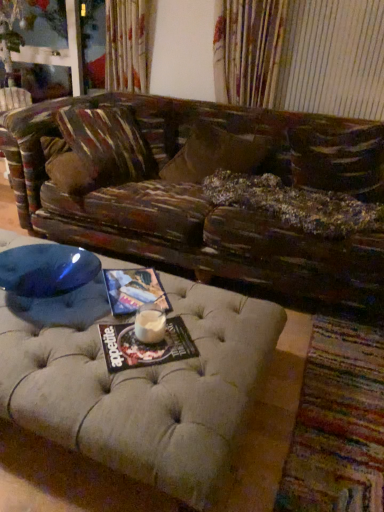
Measure the distance between point (149, 268) and camera.

Point (149, 268) is 6.05 feet from camera.

What do you see at coordinates (13, 101) in the screenshot? The width and height of the screenshot is (384, 512). I see `wooden swivel chair at left` at bounding box center [13, 101].

What are the coordinates of `white frothy liquid at center` in the screenshot? It's located at (150, 324).

Describe the element at coordinates (139, 383) in the screenshot. I see `distressed wood studio couch at center` at that location.

What do you see at coordinates (217, 153) in the screenshot?
I see `fuzzy brown pillow at center` at bounding box center [217, 153].

The height and width of the screenshot is (512, 384). What are the coordinates of `multicolored woven mat at lower right` in the screenshot? It's located at (338, 424).

Is white frothy liquid at center facing towards matte paper magazine at center, acting as the 2th magazine starting from the front?

No, white frothy liquid at center is not turned towards matte paper magazine at center, acting as the 2th magazine starting from the front.

In the scene shown: Are white frothy liquid at center and matte paper magazine at center, acting as the 2th magazine starting from the front, beside each other?

white frothy liquid at center is not next to matte paper magazine at center, acting as the 2th magazine starting from the front, and they're not touching.

Do you think white frothy liquid at center is within matte paper magazine at center, the 1th magazine viewed from the back, or outside of it?

white frothy liquid at center is not enclosed by matte paper magazine at center, the 1th magazine viewed from the back.

Is white frothy liquid at center shorter than matte paper magazine at center, the 1th magazine viewed from the back?

No, white frothy liquid at center is not shorter than matte paper magazine at center, the 1th magazine viewed from the back.

Where is `pillow on the right of wooden swivel chair at left`? Image resolution: width=384 pixels, height=512 pixels. pillow on the right of wooden swivel chair at left is located at coordinates (217, 153).

Is wooden swivel chair at left positioned before fuzzy brown pillow at center?

No, the depth of wooden swivel chair at left is greater than that of fuzzy brown pillow at center.

Which is more to the right, wooden swivel chair at left or fuzzy brown pillow at center?

fuzzy brown pillow at center is more to the right.

Consider the image. Considering the sizes of distressed wood studio couch at center and wooden swivel chair at left in the image, is distressed wood studio couch at center wider or thinner than wooden swivel chair at left?

distressed wood studio couch at center is wider than wooden swivel chair at left.

Considering the relative positions of distressed wood studio couch at center and wooden swivel chair at left in the image provided, is distressed wood studio couch at center behind wooden swivel chair at left?

That is False.

Does distressed wood studio couch at center contain wooden swivel chair at left?

No, distressed wood studio couch at center does not contain wooden swivel chair at left.

Considering the sizes of distressed wood studio couch at center and wooden swivel chair at left in the image, is distressed wood studio couch at center taller or shorter than wooden swivel chair at left?

distressed wood studio couch at center is shorter than wooden swivel chair at left.

Is matte paper magazine at center, the second magazine viewed from the top, a part of fuzzy brown pillow at center?

Definitely not — matte paper magazine at center, the second magazine viewed from the top, is not inside fuzzy brown pillow at center.

Between fuzzy brown pillow at center and matte paper magazine at center, marked as the 1th magazine in a bottom-to-top arrangement, which one has less height?

matte paper magazine at center, marked as the 1th magazine in a bottom-to-top arrangement, is shorter.

Which object is further away from the camera taking this photo, fuzzy brown pillow at center or matte paper magazine at center, the second magazine viewed from the top?

Positioned behind is fuzzy brown pillow at center.

From a real-world perspective, is fuzzy brown pillow at center physically below distressed wood studio couch at center?

No, from a real-world perspective, fuzzy brown pillow at center is not below distressed wood studio couch at center.

Between fuzzy brown pillow at center and distressed wood studio couch at center, which one has larger size?

Bigger between the two is distressed wood studio couch at center.

How distant is fuzzy brown pillow at center from distressed wood studio couch at center?

fuzzy brown pillow at center and distressed wood studio couch at center are 4.04 feet apart from each other.

Considering the positions of point (241, 136) and point (62, 375), is point (241, 136) closer or farther from the camera than point (62, 375)?

Point (241, 136).

Which object is wider, fuzzy brown pillow at center or multicolored woven mat at lower right?

multicolored woven mat at lower right is wider.

From the image's perspective, which is above, fuzzy brown pillow at center or multicolored woven mat at lower right?

fuzzy brown pillow at center appears higher in the image.

Does point (229, 144) come closer to viewer compared to point (303, 425)?

No, (229, 144) is behind (303, 425).

Which magazine is the 1st one when counting from the right side of the distressed wood studio couch at center? Please provide its 2D coordinates.

[(134, 290)]

Looking at this image, from the image's perspective, which object appears higher, matte paper magazine at center, acting as the 2th magazine starting from the front, or distressed wood studio couch at center?

distressed wood studio couch at center.

How different are the orientations of matte paper magazine at center, which is counted as the first magazine, starting from the top, and distressed wood studio couch at center in degrees?

The facing directions of matte paper magazine at center, which is counted as the first magazine, starting from the top, and distressed wood studio couch at center are 37.8 degrees apart.

Is point (161, 308) closer or farther from the camera than point (195, 478)?

Point (161, 308).

Where is `beverage below the matte paper magazine at center, acting as the 2th magazine starting from the front (from the image's perspective)`? beverage below the matte paper magazine at center, acting as the 2th magazine starting from the front (from the image's perspective) is located at coordinates (150, 324).

Where is `swivel chair that is on the left side of fuzzy brown pillow at center`? swivel chair that is on the left side of fuzzy brown pillow at center is located at coordinates (13, 101).

Based on their spatial positions, is wooden swivel chair at left or matte paper magazine at center, acting as the 2th magazine starting from the front, further from distressed wood studio couch at center?

Based on the image, wooden swivel chair at left appears to be further to distressed wood studio couch at center.

From the image, which object appears to be farther from white frothy liquid at center, wooden swivel chair at left or matte paper magazine at center, which is the second magazine from back to front?

wooden swivel chair at left lies further to white frothy liquid at center than the other object.

When comparing their distances from distressed wood studio couch at center, does matte paper magazine at center, marked as the 1th magazine in a bottom-to-top arrangement, or fuzzy brown pillow at center seem further?

fuzzy brown pillow at center lies further to distressed wood studio couch at center than the other object.

From the image, which object appears to be farther from wooden swivel chair at left, multicolored woven mat at lower right or fuzzy brown pillow at center?

multicolored woven mat at lower right is further to wooden swivel chair at left.

Estimate the real-world distances between objects in this image. Which object is closer to fuzzy brown pillow at center, distressed wood studio couch at center or wooden swivel chair at left?

Among the two, wooden swivel chair at left is located nearer to fuzzy brown pillow at center.

From the image, which object appears to be farther from distressed wood studio couch at center, multicolored woven mat at lower right or matte paper magazine at center, the first magazine in the front-to-back sequence?

Based on the image, multicolored woven mat at lower right appears to be further to distressed wood studio couch at center.

Looking at the image, which one is located closer to white frothy liquid at center, fuzzy brown pillow at center or distressed wood studio couch at center?

distressed wood studio couch at center is closer to white frothy liquid at center.

Based on their spatial positions, is wooden swivel chair at left or fuzzy brown pillow at center closer to matte paper magazine at center, which is counted as the first magazine, starting from the top?

fuzzy brown pillow at center.

This screenshot has height=512, width=384. I want to click on beverage located between matte paper magazine at center, which is the second magazine from back to front, and matte paper magazine at center, acting as the 2th magazine starting from the front, in the depth direction, so click(150, 324).

This screenshot has height=512, width=384. Identify the location of beverage between distressed wood studio couch at center and matte paper magazine at center, which is counted as the first magazine, starting from the top, along the z-axis. (150, 324).

The image size is (384, 512). I want to click on pillow between matte paper magazine at center, the second magazine viewed from the top, and wooden swivel chair at left from front to back, so click(x=217, y=153).

At what (x,y) coordinates should I click in order to perform the action: click on beverage between matte paper magazine at center, which is the second magazine from back to front, and multicolored woven mat at lower right. Please return your answer as a coordinate pair (x, y). This screenshot has height=512, width=384. Looking at the image, I should click on (150, 324).